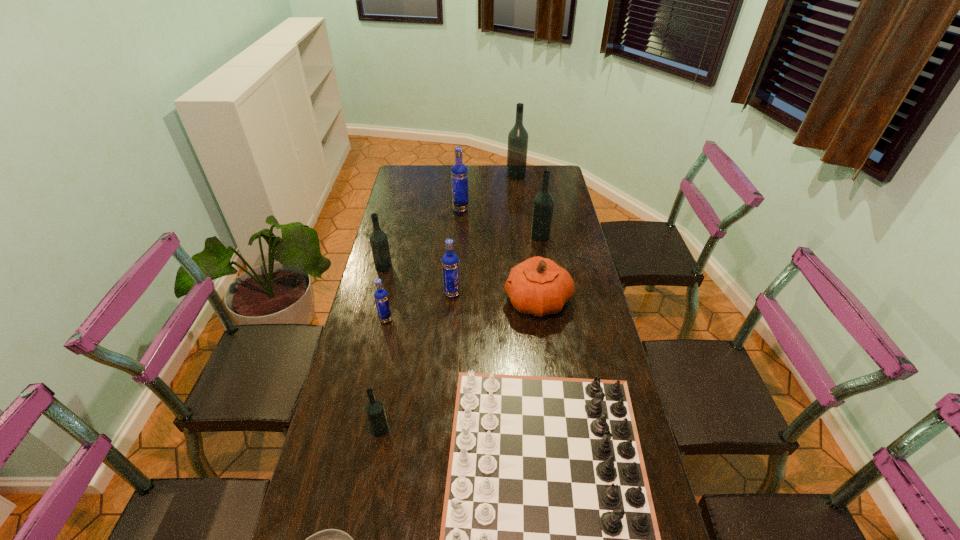
Where is `the farthest object`? The image size is (960, 540). the farthest object is located at coordinates (518, 136).

Image resolution: width=960 pixels, height=540 pixels. Identify the location of the biggest black vodka. (518, 136).

The width and height of the screenshot is (960, 540). Identify the location of the biggest blue vodka. (459, 173).

Locate an element on the screen. This screenshot has width=960, height=540. the second farthest vodka is located at coordinates (459, 173).

Locate an element on the screen. the third farthest vodka is located at coordinates (543, 203).

Where is `the third nearest black vodka`? The image size is (960, 540). the third nearest black vodka is located at coordinates (543, 203).

You are a GUI agent. You are given a task and a screenshot of the screen. Output one action in this format:
    pyautogui.click(x=<x>, y=<y>)
    Task: Click on the fourth farthest object
    
    Given the screenshot: What is the action you would take?
    pyautogui.click(x=378, y=239)

Where is `the leftmost black vodka`? This screenshot has height=540, width=960. the leftmost black vodka is located at coordinates (378, 239).

Where is `the second smallest blue vodka`? The height and width of the screenshot is (540, 960). the second smallest blue vodka is located at coordinates (450, 263).

Identify the location of the third nearest vodka. (450, 263).